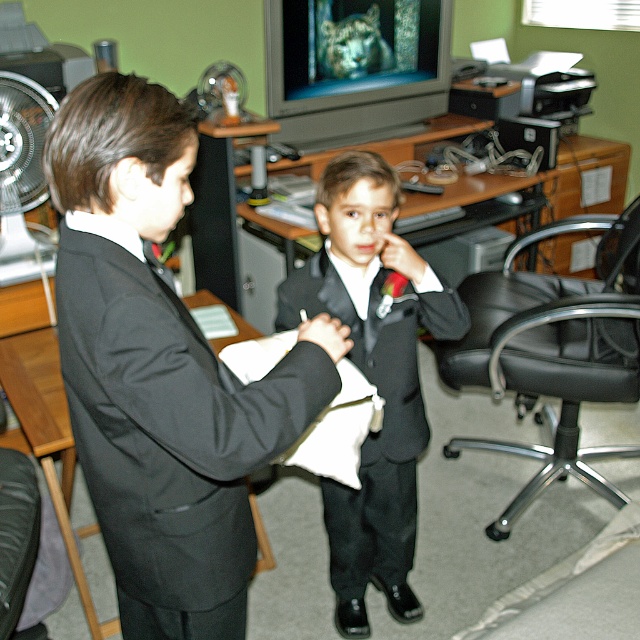
Is point (337, 497) positioned after point (19, 212)?

No.

What do you see at coordinates (372, 376) in the screenshot? I see `shiny black suit at center` at bounding box center [372, 376].

You are a GUI agent. You are given a task and a screenshot of the screen. Output one action in this format:
    pyautogui.click(x=<x>, y=<y>)
    Task: Click on the shiny black suit at center
    The height and width of the screenshot is (640, 640).
    Given the screenshot: What is the action you would take?
    pyautogui.click(x=372, y=376)

From the picture: Who is higher up, matte black suit at center or brushed metal fan at left?

brushed metal fan at left is above.

From the picture: Is matte black suit at center to the left of brushed metal fan at left from the viewer's perspective?

In fact, matte black suit at center is to the right of brushed metal fan at left.

Where is `matte black suit at center`? The height and width of the screenshot is (640, 640). matte black suit at center is located at coordinates (161, 371).

This screenshot has height=640, width=640. Describe the element at coordinates (372, 376) in the screenshot. I see `shiny black suit at center` at that location.

Does point (352, 230) come farther from viewer compared to point (513, 508)?

No, (352, 230) is closer to viewer.

Is point (326, 276) closer to viewer compared to point (524, 369)?

Yes, it is in front of point (524, 369).

The width and height of the screenshot is (640, 640). I want to click on shiny black suit at center, so click(372, 376).